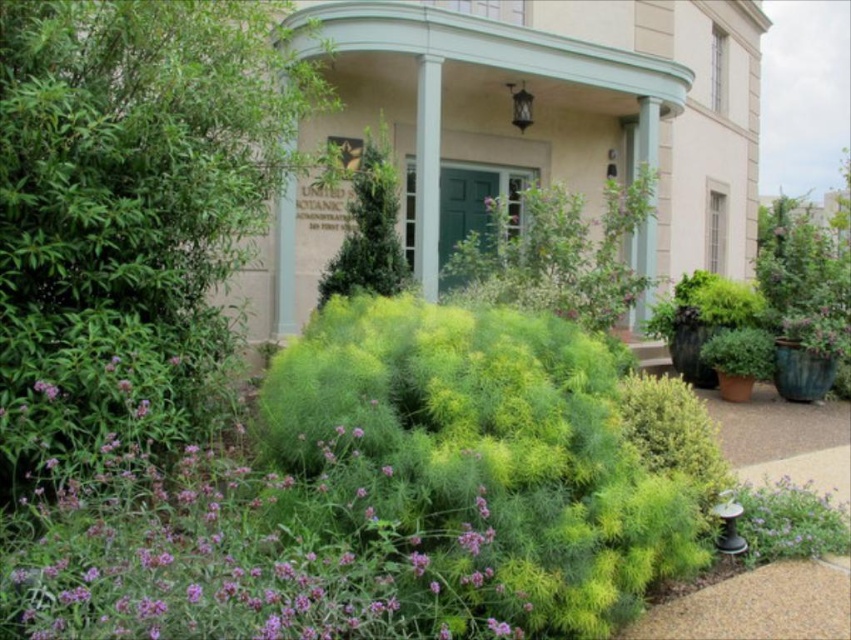
Which is below, green leafy bush at center or purple matte flower at center?

green leafy bush at center

Describe the element at coordinates (557, 253) in the screenshot. I see `green leafy bush at center` at that location.

This screenshot has height=640, width=851. I want to click on green leafy bush at center, so click(557, 253).

Can you confirm if purple soft-textured flowers at center is smaller than green fuzzy bush at center?

Yes, purple soft-textured flowers at center is smaller than green fuzzy bush at center.

Which is below, purple soft-textured flowers at center or green fuzzy bush at center?

purple soft-textured flowers at center

The width and height of the screenshot is (851, 640). What do you see at coordinates (231, 561) in the screenshot?
I see `purple soft-textured flowers at center` at bounding box center [231, 561].

I want to click on purple soft-textured flowers at center, so click(x=231, y=561).

Is purple soft-textured flowers at center bigger than purple matte flower at lower left?

Correct, purple soft-textured flowers at center is larger in size than purple matte flower at lower left.

Is purple soft-textured flowers at center above purple matte flower at lower left?

No.

Between point (163, 618) and point (38, 387), which one is positioned behind?

Positioned behind is point (38, 387).

What are the coordinates of `purple soft-textured flowers at center` in the screenshot? It's located at (231, 561).